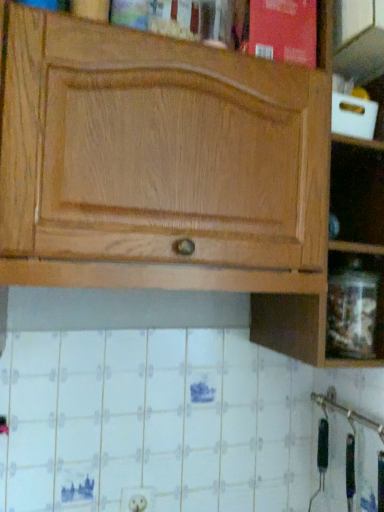
Question: Is point (132, 151) positioned closer to the camera than point (331, 265)?

Choices:
 (A) farther
 (B) closer

Answer: (B)

Question: Is natural wood cabinet at upper center in front of or behind transparent glass jar at lower right in the image?

Choices:
 (A) front
 (B) behind

Answer: (A)

Question: Considering the real-world distances, which object is farthest from the white plastic electric outlet at lower center?

Choices:
 (A) natural wood cabinet at upper center
 (B) transparent glass jar at lower right

Answer: (A)

Question: Which object is positioned closest to the white plastic electric outlet at lower center?

Choices:
 (A) natural wood cabinet at upper center
 (B) transparent glass jar at lower right

Answer: (B)